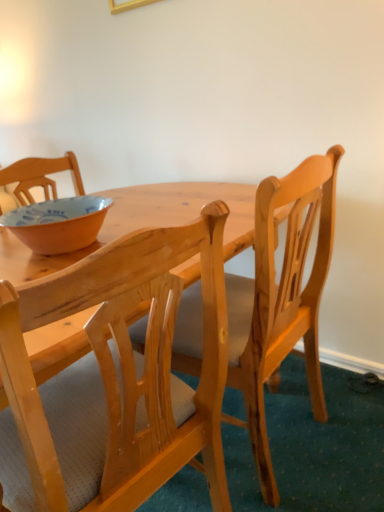
Question: Should I look upward or downward to see matte orange bowl at left?

Choices:
 (A) up
 (B) down

Answer: (A)

Question: Considering the relative sizes of natural wood chair at center, the 1th chair in the left-to-right sequence, and matte orange bowl at left in the image provided, is natural wood chair at center, the 1th chair in the left-to-right sequence, smaller than matte orange bowl at left?

Choices:
 (A) yes
 (B) no

Answer: (B)

Question: Is natural wood chair at center, which is the second chair in right-to-left order, facing towards matte orange bowl at left?

Choices:
 (A) no
 (B) yes

Answer: (A)

Question: Does natural wood chair at center, the 1th chair in the left-to-right sequence, have a greater width compared to matte orange bowl at left?

Choices:
 (A) no
 (B) yes

Answer: (B)

Question: Can you confirm if natural wood chair at center, the 1th chair in the left-to-right sequence, is positioned to the right of matte orange bowl at left?

Choices:
 (A) no
 (B) yes

Answer: (B)

Question: Would you say matte orange bowl at left is part of natural wood chair at center, which is the second chair in right-to-left order,'s contents?

Choices:
 (A) yes
 (B) no

Answer: (B)

Question: Is natural wood chair at center, which is the second chair in right-to-left order, in front of matte orange bowl at left?

Choices:
 (A) yes
 (B) no

Answer: (A)

Question: Is natural wood chair at center, the second chair from the left, inside natural wood chair at center, the 1th chair in the left-to-right sequence?

Choices:
 (A) yes
 (B) no

Answer: (B)

Question: Can you see natural wood chair at center, which is the second chair in right-to-left order, touching natural wood chair at center, the second chair from the left?

Choices:
 (A) no
 (B) yes

Answer: (A)

Question: Is natural wood chair at center, the 1th chair in the left-to-right sequence, aimed at natural wood chair at center, marked as the first chair in a right-to-left arrangement?

Choices:
 (A) no
 (B) yes

Answer: (A)

Question: Can you confirm if natural wood chair at center, which is the second chair in right-to-left order, is wider than natural wood chair at center, the second chair from the left?

Choices:
 (A) no
 (B) yes

Answer: (B)

Question: Can you confirm if natural wood chair at center, the 1th chair in the left-to-right sequence, is positioned to the left of natural wood chair at center, the second chair from the left?

Choices:
 (A) yes
 (B) no

Answer: (A)

Question: Considering the relative sizes of natural wood chair at center, which is the second chair in right-to-left order, and natural wood chair at center, marked as the first chair in a right-to-left arrangement, in the image provided, is natural wood chair at center, which is the second chair in right-to-left order, taller than natural wood chair at center, marked as the first chair in a right-to-left arrangement,?

Choices:
 (A) yes
 (B) no

Answer: (B)

Question: Considering the relative sizes of natural wood chair at center, the second chair from the left, and natural wood chair at center, the 1th chair in the left-to-right sequence, in the image provided, is natural wood chair at center, the second chair from the left, bigger than natural wood chair at center, the 1th chair in the left-to-right sequence,?

Choices:
 (A) no
 (B) yes

Answer: (B)